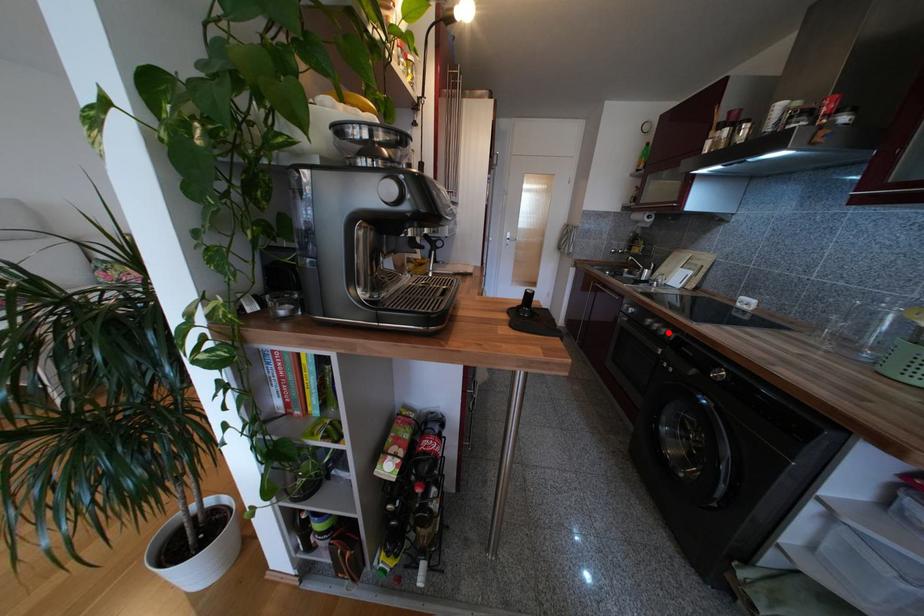
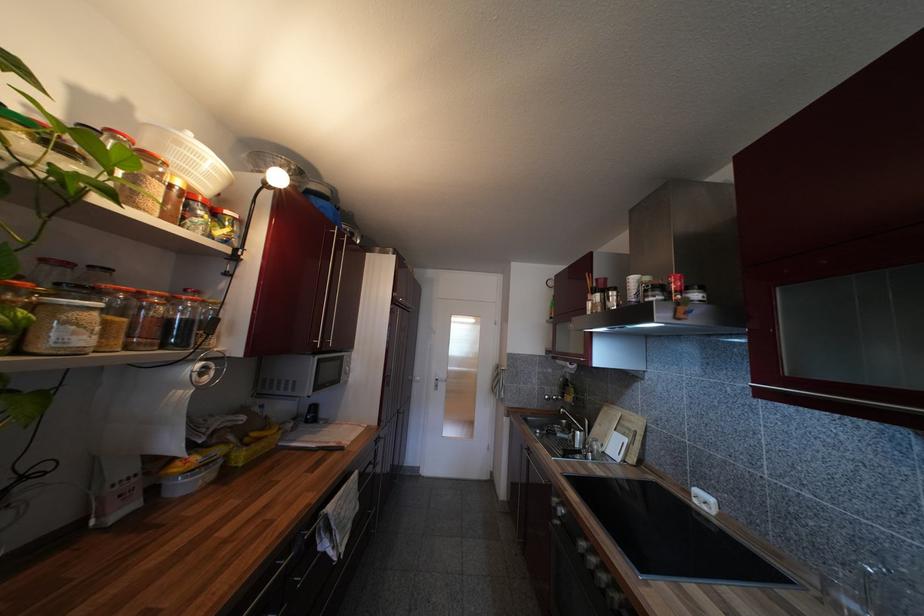
Question: A red point is marked in image1. In image2, is the corresponding 3D point closer to the camera or farther? Reply with the corresponding letter.

Choices:
 (A) The corresponding 3D point is closer.
 (B) The corresponding 3D point is farther.

Answer: (B)